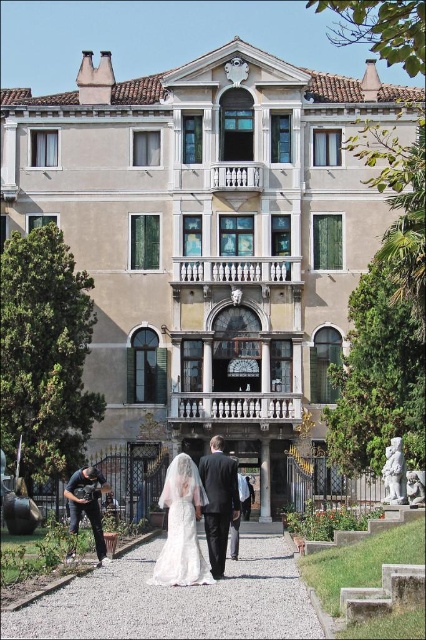
You are a fashion designer observing a photo of a historic building. In the image, there are two items of clothing present. One is a dark gray suit at center and the other is a dark gray fabric jacket at lower left. Which clothing item appears larger in the image?

The dark gray suit at center appears larger than the dark gray fabric jacket at lower left because it is taller.

You are a fashion designer visiting the historic building and see the white lace dress at center and the dark gray fabric jacket at lower left. Which clothing item is positioned to the right side?

The white lace dress at center is positioned to the right of the dark gray fabric jacket at lower left.

You are standing in the garden of the historic building and see both the gray gravel path at center and the white lace dress at center. Which object is positioned to the right of the other?

The gray gravel path at center is to the right of the white lace dress at center.